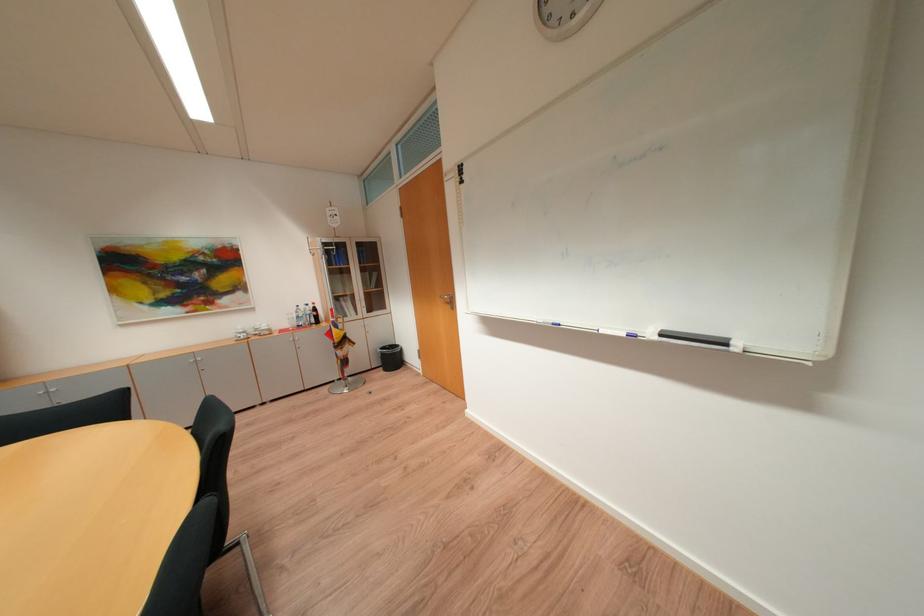
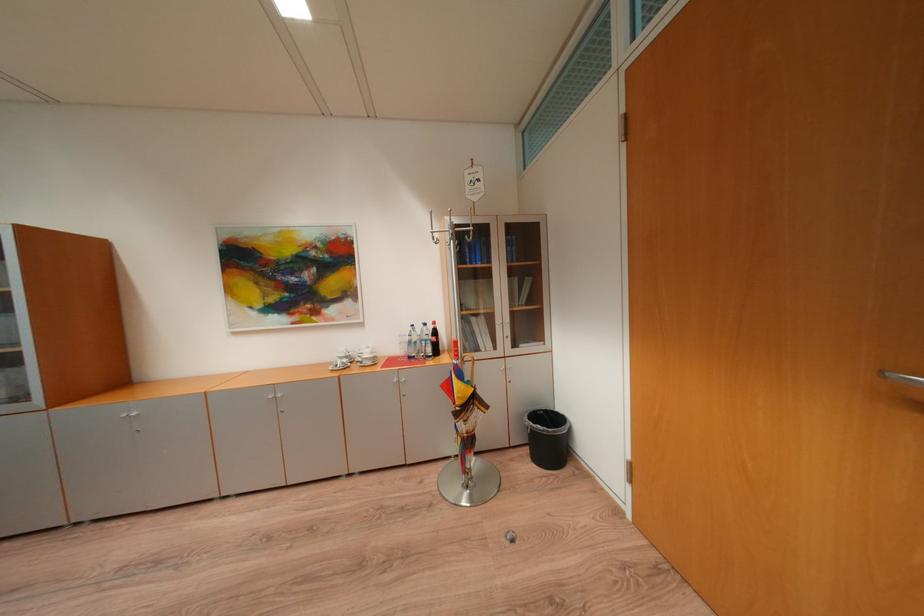
Find the pixel in the second image that matches point (338, 334) in the first image.

(456, 387)